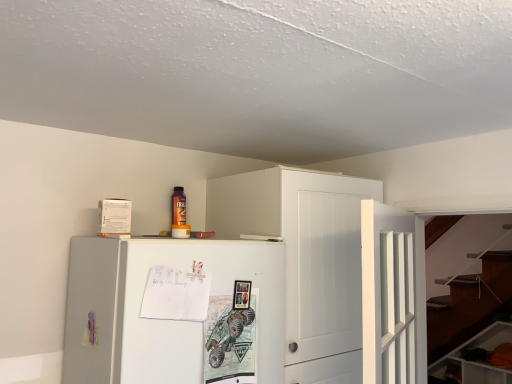
Question: In the image, is white matte cabinet at upper center, the 1th cabinetry in the left-to-right sequence, positioned in front of or behind white glossy cabinet at lower right, marked as the first cabinetry in a right-to-left arrangement?

Choices:
 (A) behind
 (B) front

Answer: (B)

Question: In terms of height, does white matte cabinet at upper center, the 1th cabinetry positioned from the front, look taller or shorter compared to white glossy cabinet at lower right, the second cabinetry from the front?

Choices:
 (A) tall
 (B) short

Answer: (A)

Question: Which object is the closest to the white matte cabinet at upper center, which is counted as the 2th cabinetry, starting from the bottom?

Choices:
 (A) white matte refrigerator at center
 (B) white glossy cabinet at lower right, the second cabinetry positioned from the left
 (C) white wooden door at center-right

Answer: (C)

Question: Estimate the real-world distances between objects in this image. Which object is farther from the white wooden door at center-right?

Choices:
 (A) white matte cabinet at upper center, which is counted as the 2th cabinetry, starting from the bottom
 (B) white glossy cabinet at lower right, marked as the first cabinetry in a right-to-left arrangement
 (C) white matte refrigerator at center

Answer: (B)